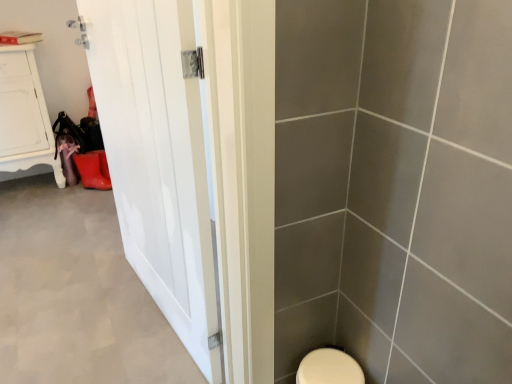
Identify the location of white wood cabinet at upper left. (24, 114).

Is white glossy door at left at the left side of white matte door at left?

In fact, white glossy door at left is to the right of white matte door at left.

Is white glossy door at left spatially inside white matte door at left, or outside of it?

white glossy door at left cannot be found inside white matte door at left.

Considering the relative sizes of white glossy door at left and white matte door at left in the image provided, is white glossy door at left taller than white matte door at left?

Yes, white glossy door at left is taller than white matte door at left.

Based on the photo, is white glossy door at left in front of or behind white matte door at left in the image?

Clearly, white glossy door at left is in front of white matte door at left.

Considering the positions of objects white matte door at left and white wood cabinet at upper left in the image provided, who is in front, white matte door at left or white wood cabinet at upper left?

white matte door at left is closer to the camera.

Between point (33, 287) and point (38, 120), which one is positioned behind?

The point (38, 120) is farther from the camera.

Is white matte door at left next to white wood cabinet at upper left and touching it?

No, white matte door at left is not with white wood cabinet at upper left.

Is white matte door at left positioned behind white glossy door at left?

Yes, white matte door at left is further from the camera.

Is white matte door at left inside or outside of white glossy door at left?

white matte door at left is outside white glossy door at left.

Who is shorter, white matte door at left or white glossy door at left?

white matte door at left is shorter.

Considering the points (97, 329) and (144, 36), which point is behind, point (97, 329) or point (144, 36)?

Point (97, 329)

Is white wood cabinet at upper left inside the boundaries of white glossy door at left, or outside?

white wood cabinet at upper left is spatially situated outside white glossy door at left.

Is white wood cabinet at upper left facing towards white glossy door at left?

Yes, white wood cabinet at upper left is aimed at white glossy door at left.

In the scene shown: How many degrees apart are the facing directions of white wood cabinet at upper left and white matte door at left?

The angle between the facing direction of white wood cabinet at upper left and the facing direction of white matte door at left is 0.36 degrees.

Is white wood cabinet at upper left wider or thinner than white matte door at left?

Clearly, white wood cabinet at upper left has less width compared to white matte door at left.

Is white wood cabinet at upper left aimed at white matte door at left?

Yes, white wood cabinet at upper left is oriented towards white matte door at left.

Is point (28, 62) positioned before point (37, 344)?

That is False.

In the scene shown: Is white glossy door at left taller or shorter than white wood cabinet at upper left?

In the image, white glossy door at left appears to be taller than white wood cabinet at upper left.

Does white glossy door at left lie in front of white wood cabinet at upper left?

Yes, white glossy door at left is closer to the viewer.

The width and height of the screenshot is (512, 384). Find the location of `plain behind the white glossy door at left`. plain behind the white glossy door at left is located at coordinates (76, 294).

Find the location of `plain located in front of the white wood cabinet at upper left`. plain located in front of the white wood cabinet at upper left is located at coordinates (76, 294).

In the scene shown: Looking at the image, which one is located closer to white matte door at left, white wood cabinet at upper left or white glossy door at left?

white glossy door at left lies closer to white matte door at left than the other object.

Estimate the real-world distances between objects in this image. Which object is further from white matte door at left, white glossy door at left or white wood cabinet at upper left?

Based on the image, white wood cabinet at upper left appears to be further to white matte door at left.

When comparing their distances from white wood cabinet at upper left, does white matte door at left or white glossy door at left seem further?

Among the two, white glossy door at left is located further to white wood cabinet at upper left.

Consider the image. When comparing their distances from white wood cabinet at upper left, does white glossy door at left or white matte door at left seem further?

white glossy door at left.

Looking at this image, when comparing their distances from white glossy door at left, does white wood cabinet at upper left or white matte door at left seem closer?

The object closer to white glossy door at left is white matte door at left.

Estimate the real-world distances between objects in this image. Which object is closer to white glossy door at left, white matte door at left or white wood cabinet at upper left?

white matte door at left lies closer to white glossy door at left than the other object.

At what (x,y) coordinates should I click in order to perform the action: click on plain between white glossy door at left and white wood cabinet at upper left from front to back. Please return your answer as a coordinate pair (x, y). The width and height of the screenshot is (512, 384). Looking at the image, I should click on (76, 294).